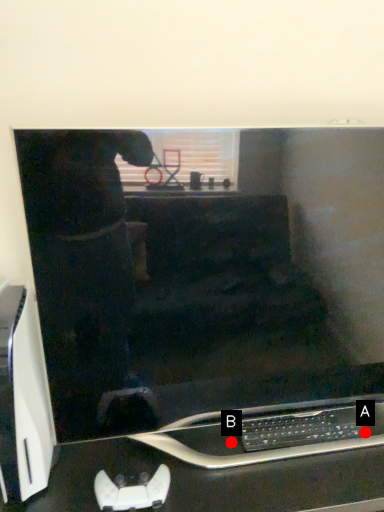
Question: Two points are circled on the image, labeled by A and B beside each circle. Which of the following is the closest to the observer?

Choices:
 (A) A is closer
 (B) B is closer

Answer: (B)